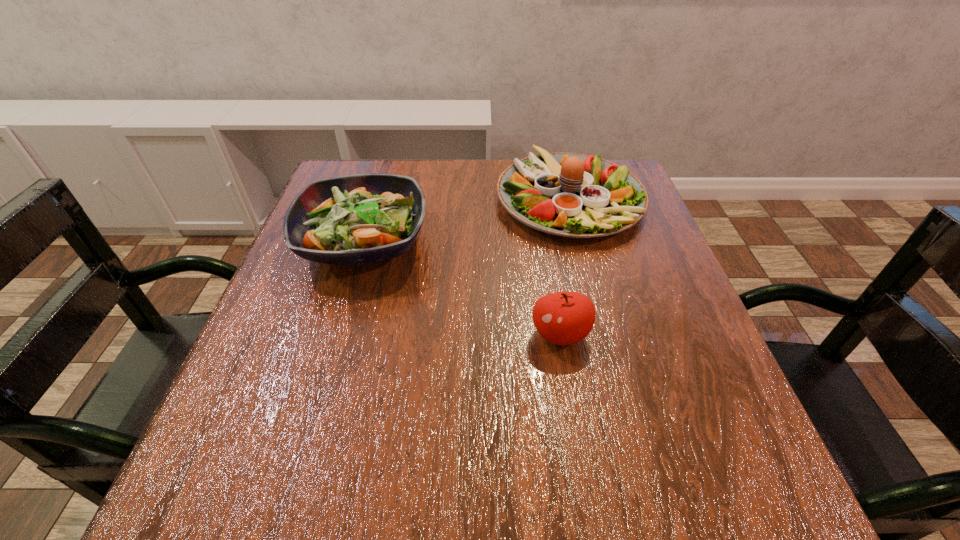
You are a GUI agent. You are given a task and a screenshot of the screen. Output one action in this format:
    pyautogui.click(x=<x>, y=<y>)
    Task: Click on the vacant space at the far edge
    
    Given the screenshot: What is the action you would take?
    (433, 173)

Where is `vacant region at the near edge of the desktop`? The height and width of the screenshot is (540, 960). vacant region at the near edge of the desktop is located at coordinates (452, 462).

I want to click on free space at the left edge of the desktop, so [347, 336].

At what (x,y) coordinates should I click in order to perform the action: click on vacant area at the right edge of the desktop. Please return your answer as a coordinate pair (x, y). Image resolution: width=960 pixels, height=540 pixels. Looking at the image, I should click on (632, 300).

At what (x,y) coordinates should I click in order to perform the action: click on vacant space at the near right corner of the desktop. Please return your answer as a coordinate pair (x, y). Looking at the image, I should click on (703, 470).

The width and height of the screenshot is (960, 540). I want to click on free space between the nearest object and the right salad plate, so click(x=564, y=267).

Where is `vacant space that is in between the leftmost object and the right salad plate`? The image size is (960, 540). vacant space that is in between the leftmost object and the right salad plate is located at coordinates (467, 220).

You are a GUI agent. You are given a task and a screenshot of the screen. Output one action in this format:
    pyautogui.click(x=<x>, y=<y>)
    Task: Click on the free space between the right salad plate and the nearest object
    Image resolution: width=960 pixels, height=540 pixels.
    Given the screenshot: What is the action you would take?
    tap(564, 267)

Identify the location of free area in between the left salad plate and the apple. (462, 288).

You are a GUI agent. You are given a task and a screenshot of the screen. Output one action in this format:
    pyautogui.click(x=<x>, y=<y>)
    Task: Click on the free space between the left salad plate and the apple
    
    Given the screenshot: What is the action you would take?
    pyautogui.click(x=462, y=288)